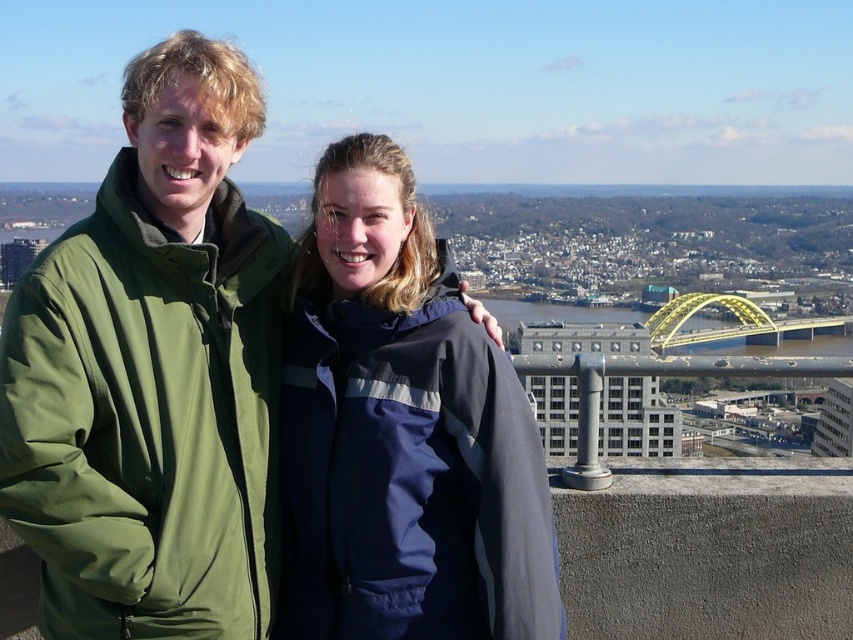
Question: Observing the image, what is the correct spatial positioning of green matte jacket at left in reference to navy blue jacket at center?

Choices:
 (A) above
 (B) below

Answer: (A)

Question: Which object appears closest to the camera in this image?

Choices:
 (A) navy blue jacket at center
 (B) green matte jacket at left

Answer: (B)

Question: Can you confirm if green matte jacket at left is wider than navy blue jacket at center?

Choices:
 (A) yes
 (B) no

Answer: (A)

Question: Which point is farther from the camera taking this photo?

Choices:
 (A) (107, 483)
 (B) (445, 355)

Answer: (B)

Question: Is green matte jacket at left thinner than navy blue jacket at center?

Choices:
 (A) no
 (B) yes

Answer: (A)

Question: Which point is closer to the camera?

Choices:
 (A) green matte jacket at left
 (B) navy blue jacket at center

Answer: (A)